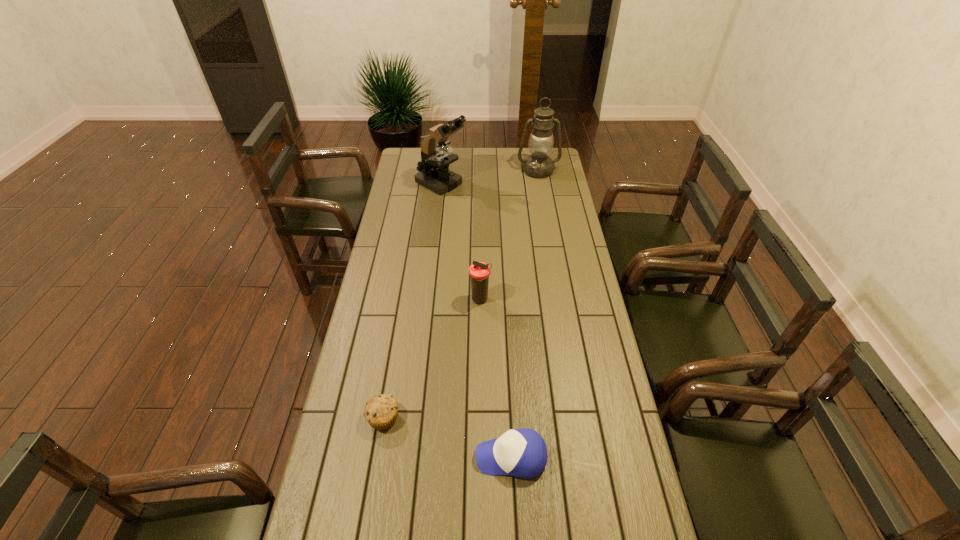
Locate an element on the screen. This screenshot has height=540, width=960. the rightmost object is located at coordinates (539, 165).

I want to click on microscope, so 434,174.

Locate an element on the screen. This screenshot has height=540, width=960. the third tallest object is located at coordinates (479, 272).

Locate an element on the screen. thermos bottle is located at coordinates click(479, 272).

Where is `the nearest object`? the nearest object is located at coordinates (522, 453).

This screenshot has width=960, height=540. What are the coordinates of `muffin` in the screenshot? It's located at (380, 412).

Where is `vacant region located on the back of the rightmost object`? The width and height of the screenshot is (960, 540). vacant region located on the back of the rightmost object is located at coordinates (535, 152).

The image size is (960, 540). I want to click on vacant space located 0.100m on the back of the microscope, so click(444, 160).

Identify the location of free space located 0.080m on the right of the third tallest object. (513, 300).

At what (x,y) coordinates should I click in order to perform the action: click on free space located on the front-facing side of the nearest object. Please return your answer as a coordinate pair (x, y). The image size is (960, 540). Looking at the image, I should click on (421, 456).